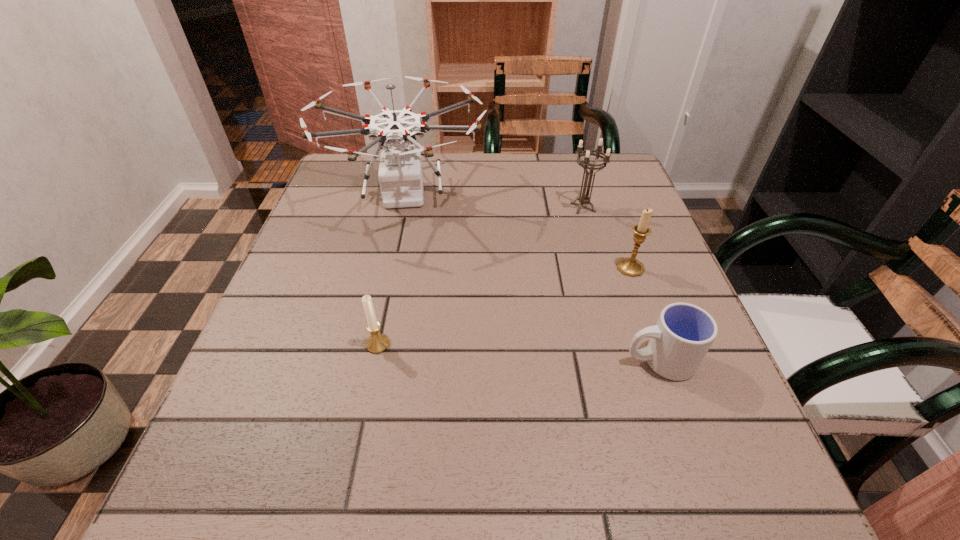
Where is `free location at the near edge of the desktop`? free location at the near edge of the desktop is located at coordinates (377, 505).

Locate an element on the screen. The image size is (960, 540). free region at the left edge of the desktop is located at coordinates (252, 446).

This screenshot has width=960, height=540. In the image, there is a desktop. Identify the location of vacant space at the right edge. (636, 306).

Where is `vacant area at the near left corner`? The image size is (960, 540). vacant area at the near left corner is located at coordinates (285, 481).

Identify the location of free location at the near right corner. The height and width of the screenshot is (540, 960). (716, 519).

Locate an element on the screen. blank region between the second nearest candle holder and the drone is located at coordinates (517, 231).

Find the location of a particular element. The height and width of the screenshot is (540, 960). vacant point located between the third nearest object and the shortest candle holder is located at coordinates (504, 306).

Locate an element on the screen. This screenshot has height=540, width=960. free point between the shortest object and the tallest object is located at coordinates (532, 278).

Identify the location of free spot between the tallest object and the farthest candle holder. This screenshot has height=540, width=960. (494, 201).

Locate an element on the screen. The image size is (960, 540). free area in between the shortest object and the tallest object is located at coordinates (532, 278).